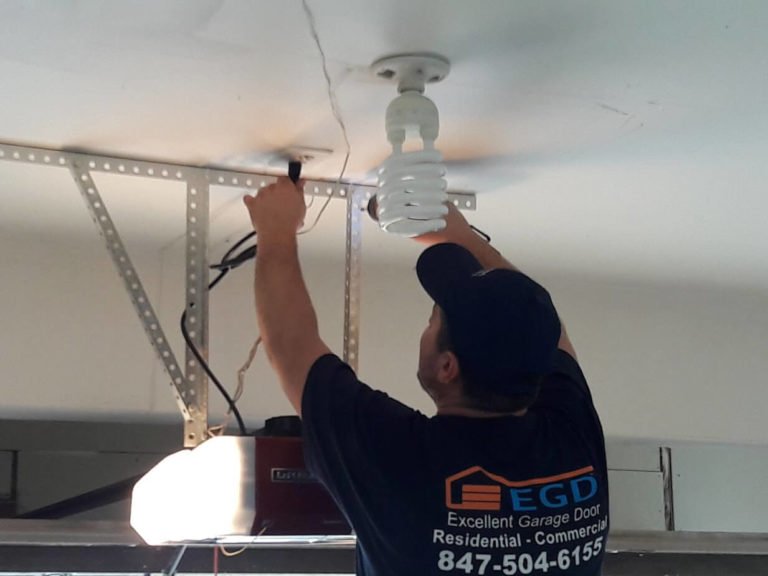
Find the location of `cable`. cable is located at coordinates (233, 265), (179, 556), (232, 551).